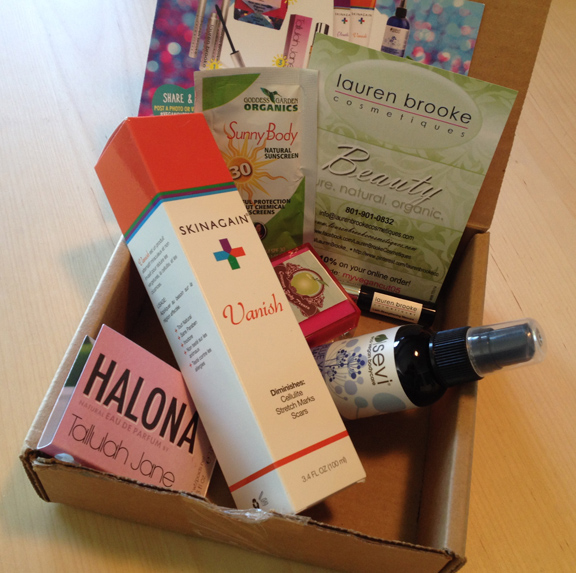
What are the coordinates of `plastic cover` in the screenshot? It's located at (524, 325).